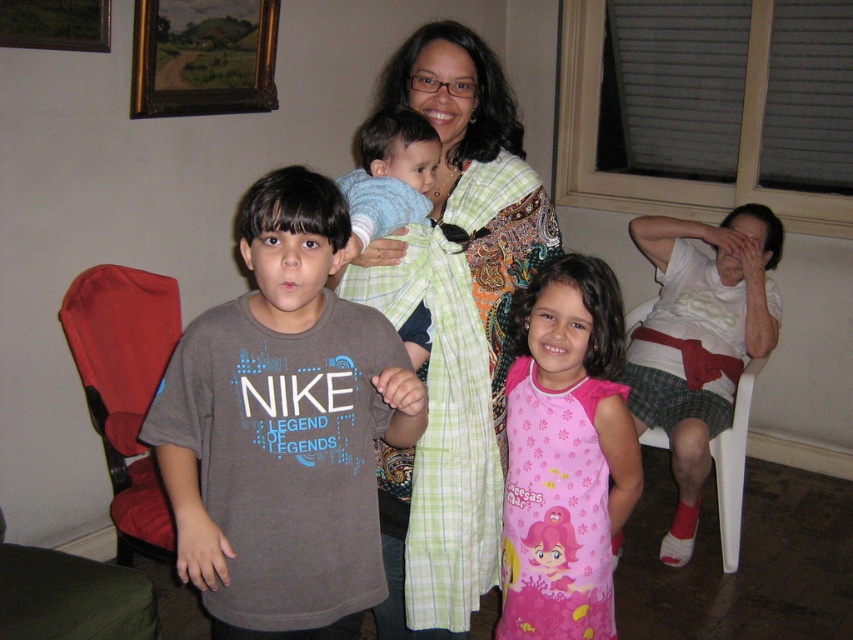
Question: Is multicolored patterned shawl at center positioned at the back of light blue plaid shirt at center?

Choices:
 (A) no
 (B) yes

Answer: (B)

Question: Among these objects, which one is farthest from the camera?

Choices:
 (A) pink fabric dress at center
 (B) matte gray t-shirt at center

Answer: (A)

Question: Among these points, which one is nearest to the camera?

Choices:
 (A) (267, 355)
 (B) (125, 467)
 (C) (358, 228)

Answer: (A)

Question: Considering the relative positions of multicolored patterned shawl at center and white plastic chair at right in the image provided, where is multicolored patterned shawl at center located with respect to white plastic chair at right?

Choices:
 (A) right
 (B) left

Answer: (B)

Question: Which object is farther from the camera taking this photo?

Choices:
 (A) red fabric highchair at left
 (B) multicolored patterned shawl at center

Answer: (A)

Question: Does multicolored patterned shawl at center appear under white plastic chair at right?

Choices:
 (A) yes
 (B) no

Answer: (B)